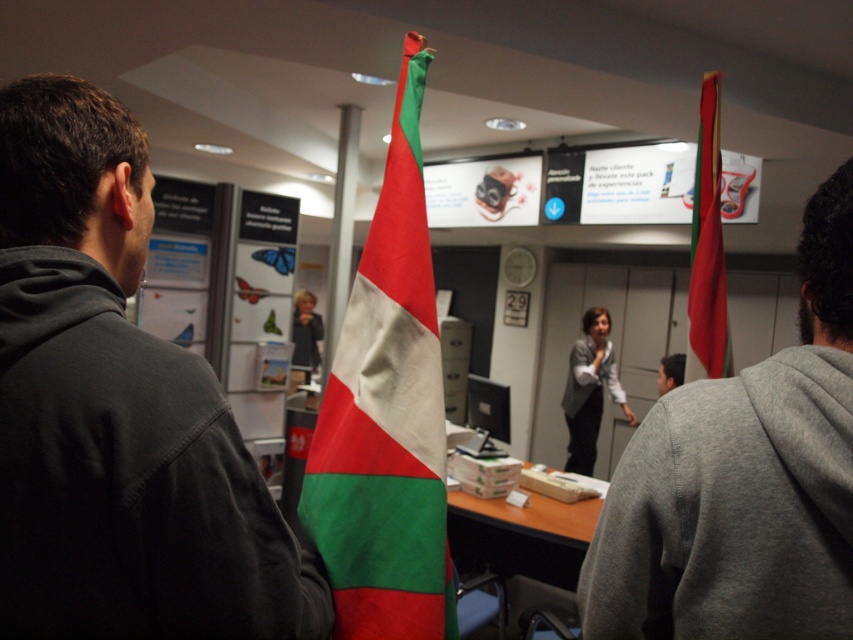
Question: Which point is closer to the camera taking this photo?

Choices:
 (A) (297, 339)
 (B) (830, 460)

Answer: (B)

Question: In this image, where is dark gray hoodie at center located relative to red fabric flag at upper right?

Choices:
 (A) right
 (B) left

Answer: (B)

Question: Is gray hoodie at right below red-green striped flag at center?

Choices:
 (A) no
 (B) yes

Answer: (B)

Question: Which point appears farthest from the camera in this image?

Choices:
 (A) (804, 371)
 (B) (579, 465)
 (C) (71, 484)

Answer: (B)

Question: Estimate the real-world distances between objects in this image. Which object is farther from the gray hoodie at right?

Choices:
 (A) dark gray hoodie at center
 (B) metallic pole at center
 (C) matte black jacket at center
 (D) red-green striped flag at center

Answer: (C)

Question: Is gray hoodie at right wider than gray fabric jacket at center?

Choices:
 (A) no
 (B) yes

Answer: (A)